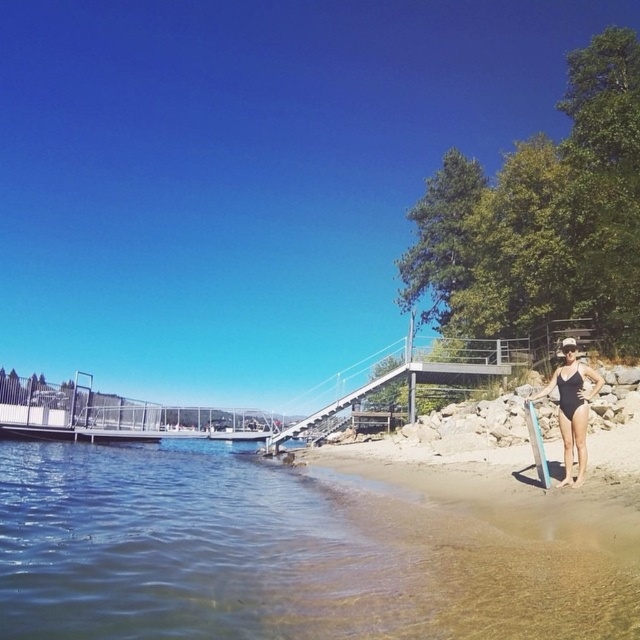
You are a photographer planning to take a wide shot of the clear blue water at lower left and the black matte swimsuit at lower right. Given that your camera has a maximum focus range of 150 feet, will you be able to capture both subjects in focus at the same time?

The distance between the clear blue water at lower left and the black matte swimsuit at lower right is 146.43 feet, which is within the camera maximum focus range of 150 feet. Therefore, you can capture both subjects in focus simultaneously.

In the scene shown: You are a photographer trying to capture the clear blue water at lower left and the black matte swimsuit at lower right in the same frame. Based on their positions, which object would appear larger in the photo?

The clear blue water at lower left would appear larger in the photo because it is much taller than the black matte swimsuit at lower right.